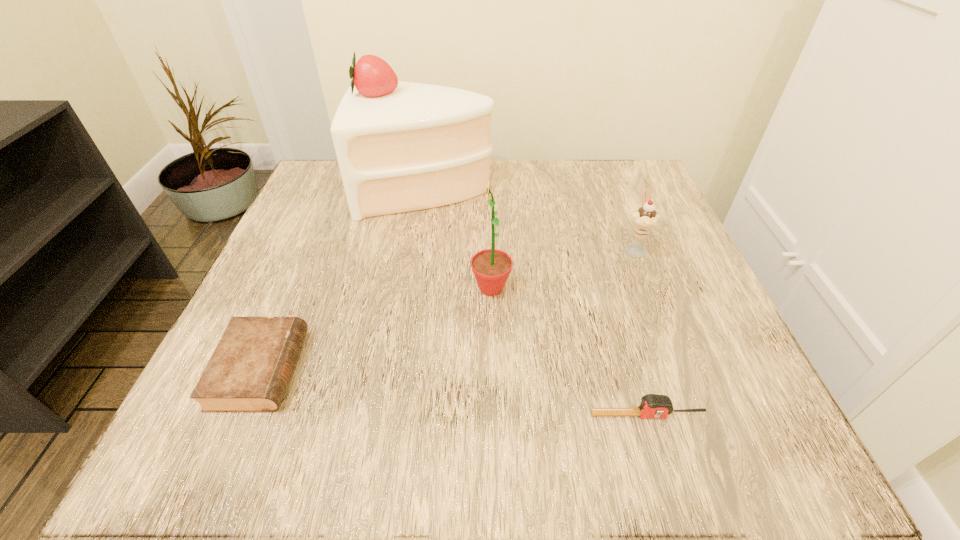
At what (x,y) coordinates should I click in order to perform the action: click on free space located 0.200m on the face of the sunflower. Please return your answer as a coordinate pair (x, y). Looking at the image, I should click on (358, 288).

Where is `vacant point located 0.340m on the face of the sunflower`? The width and height of the screenshot is (960, 540). vacant point located 0.340m on the face of the sunflower is located at coordinates (278, 288).

At what (x,y) coordinates should I click in order to perform the action: click on vacant area situated on the left of the icecream. Please return your answer as a coordinate pair (x, y). The width and height of the screenshot is (960, 540). Looking at the image, I should click on click(543, 248).

This screenshot has width=960, height=540. Find the location of `free space located 0.150m on the left of the tape measure`. free space located 0.150m on the left of the tape measure is located at coordinates (483, 415).

This screenshot has height=540, width=960. Find the location of `free region located 0.080m on the spine side of the diary`. free region located 0.080m on the spine side of the diary is located at coordinates (351, 369).

The width and height of the screenshot is (960, 540). In order to click on object that is at the far edge in this screenshot , I will do `click(401, 146)`.

At what (x,y) coordinates should I click in order to perform the action: click on tape measure that is at the near edge. Please return your answer as a coordinate pair (x, y). Image resolution: width=960 pixels, height=540 pixels. Looking at the image, I should click on (652, 405).

I want to click on diary located in the near edge section of the desktop, so click(x=249, y=371).

Locate an element on the screen. Image resolution: width=960 pixels, height=540 pixels. cake present at the left edge is located at coordinates (401, 146).

Locate an element on the screen. Image resolution: width=960 pixels, height=540 pixels. diary that is positioned at the left edge is located at coordinates (249, 371).